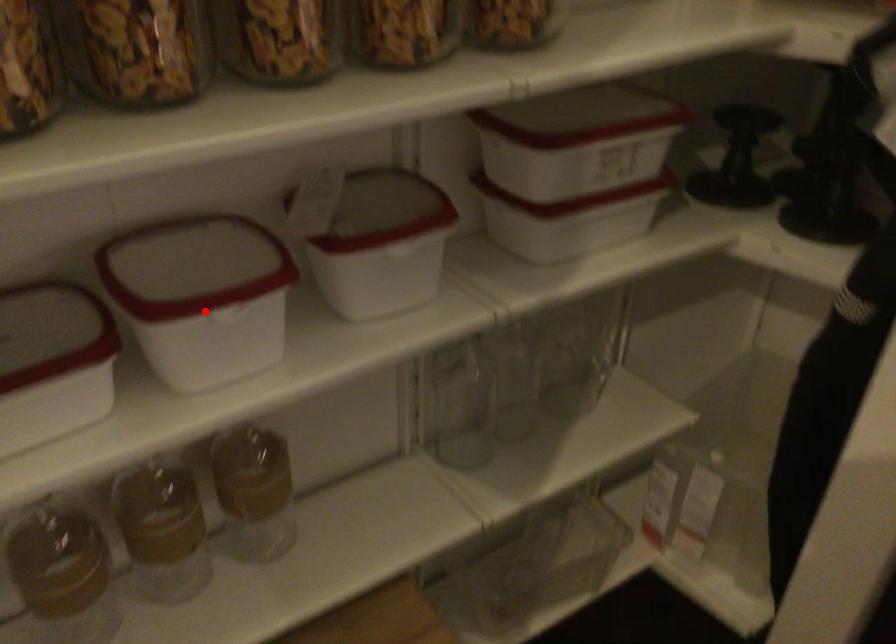
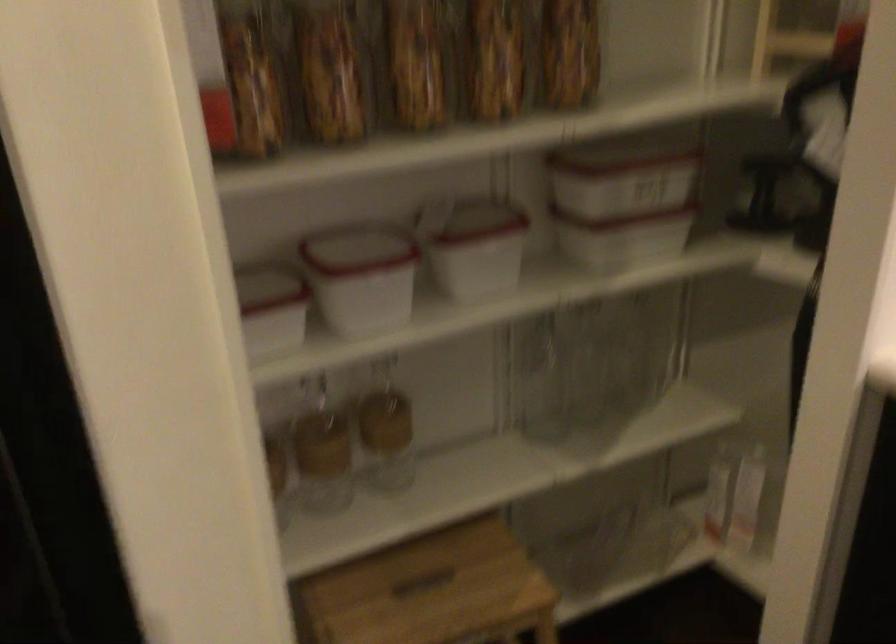
Question: I am providing you with two images of the same scene from different viewpoints. Given a red point in image1, look at the same physical point in image2. Is it:

Choices:
 (A) Closer to the viewpoint
 (B) Farther from the viewpoint

Answer: (B)